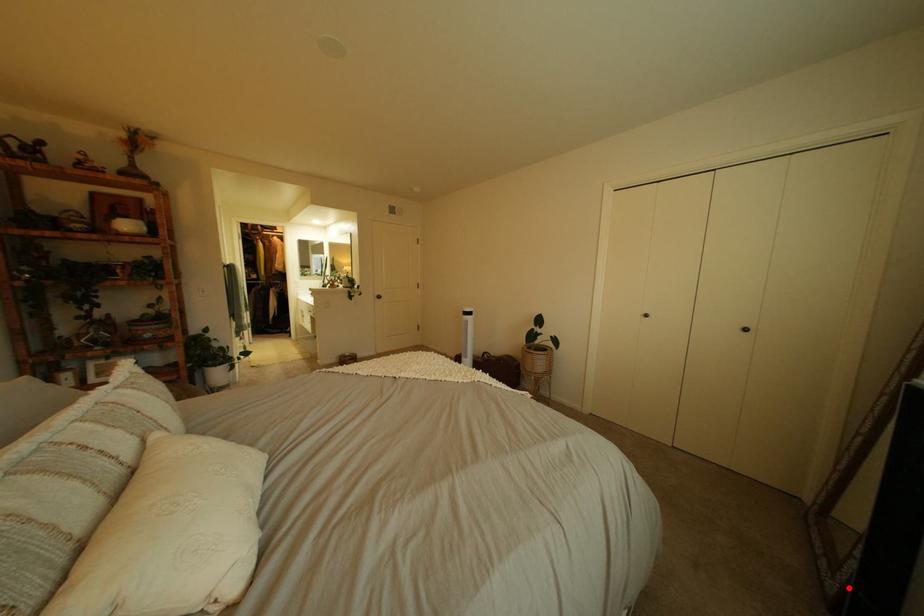
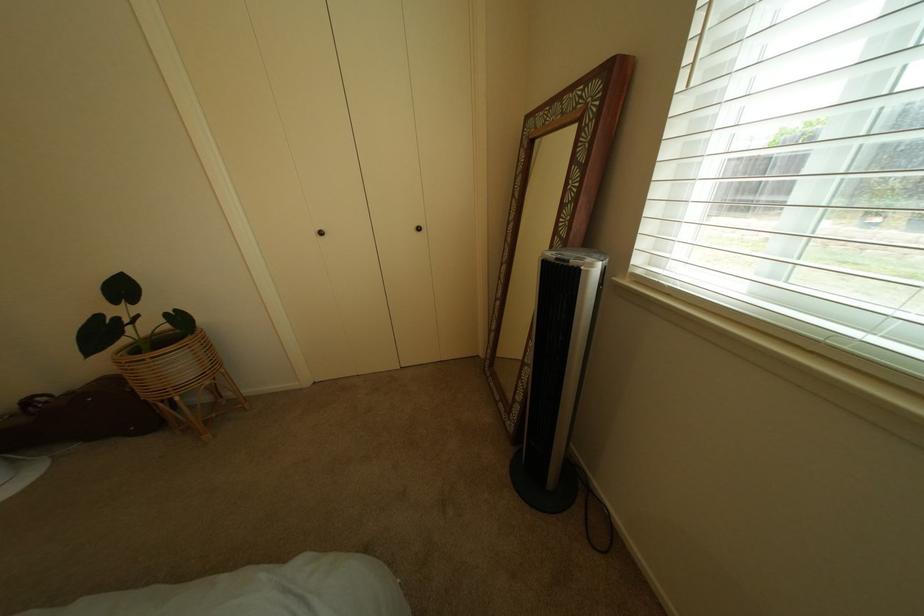
Question: I am providing you with two images of the same scene from different viewpoints. Given a red point in image1, look at the same physical point in image2. Is it:

Choices:
 (A) Closer to the viewpoint
 (B) Farther from the viewpoint

Answer: (A)